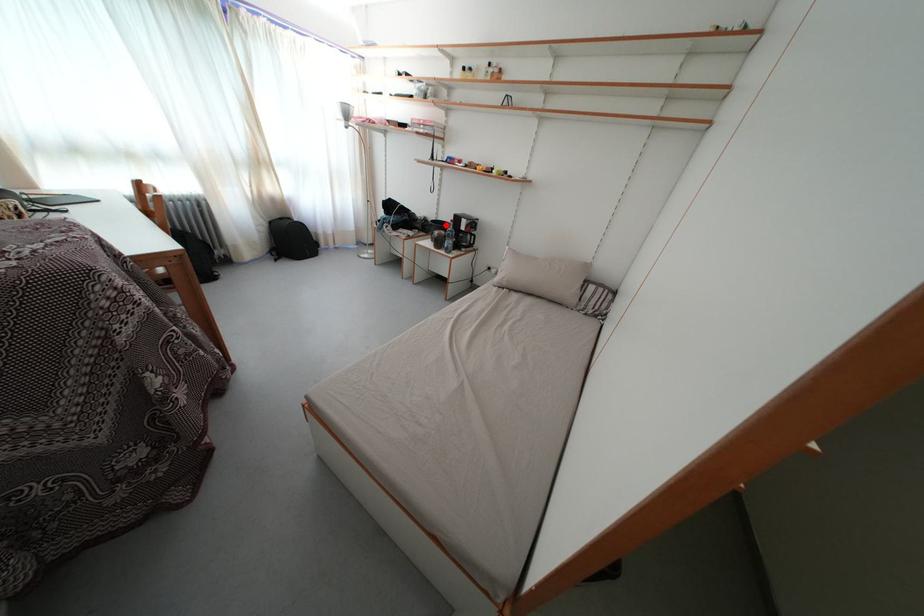
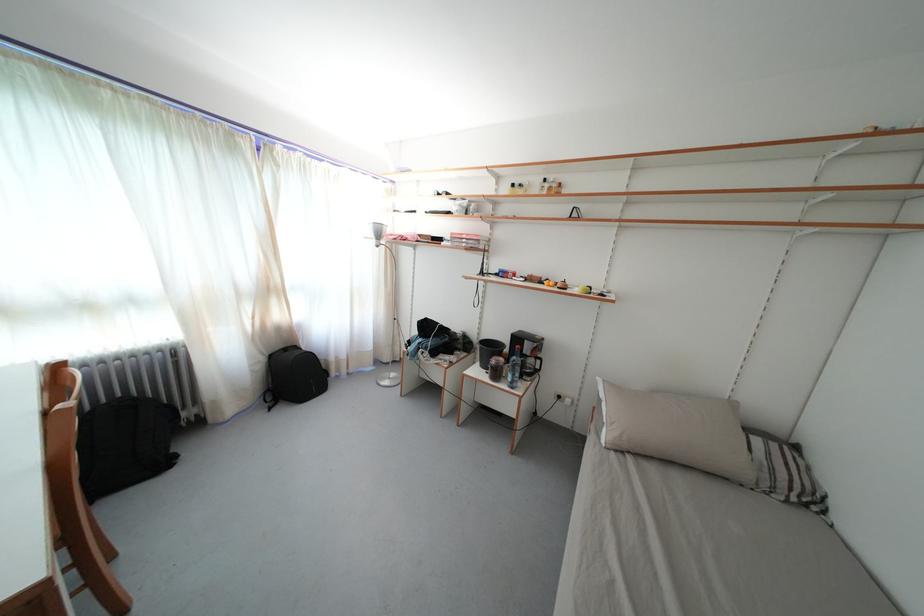
Locate, in the second image, the point that corresponds to the highlighted location in the first image.

(491, 341)